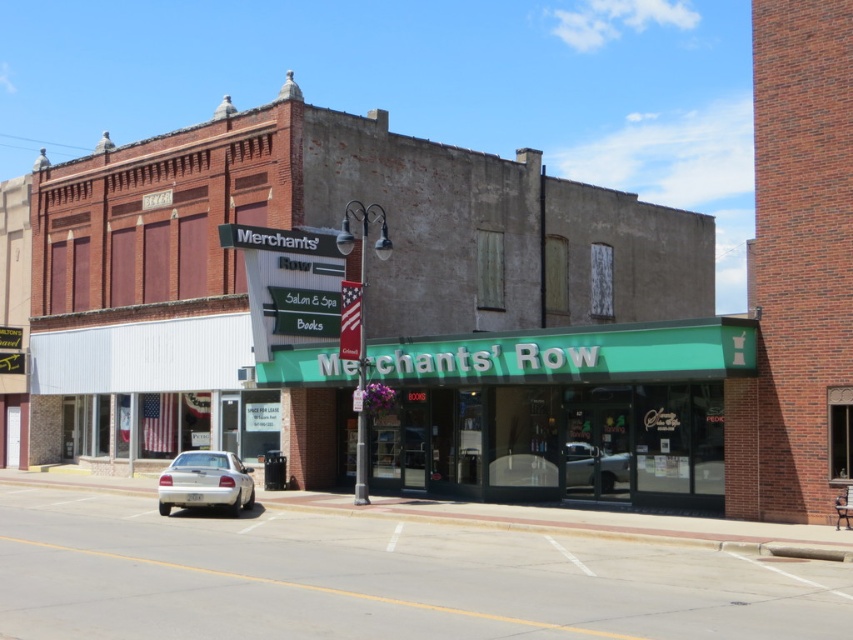
Question: Which point is closer to the camera?

Choices:
 (A) (164, 500)
 (B) (576, 458)

Answer: (A)

Question: Which object is positioned farthest from the silver metallic sedan at lower left?

Choices:
 (A) silver metallic car at center
 (B) green glass storefront at center

Answer: (A)

Question: Does green glass storefront at center appear under silver metallic car at center?

Choices:
 (A) no
 (B) yes

Answer: (A)

Question: Can you confirm if green glass storefront at center is smaller than silver metallic sedan at lower left?

Choices:
 (A) yes
 (B) no

Answer: (B)

Question: Which point appears farthest from the camera in this image?

Choices:
 (A) (438, 458)
 (B) (584, 474)
 (C) (202, 480)

Answer: (A)

Question: Is silver metallic sedan at lower left wider than silver metallic car at center?

Choices:
 (A) yes
 (B) no

Answer: (A)